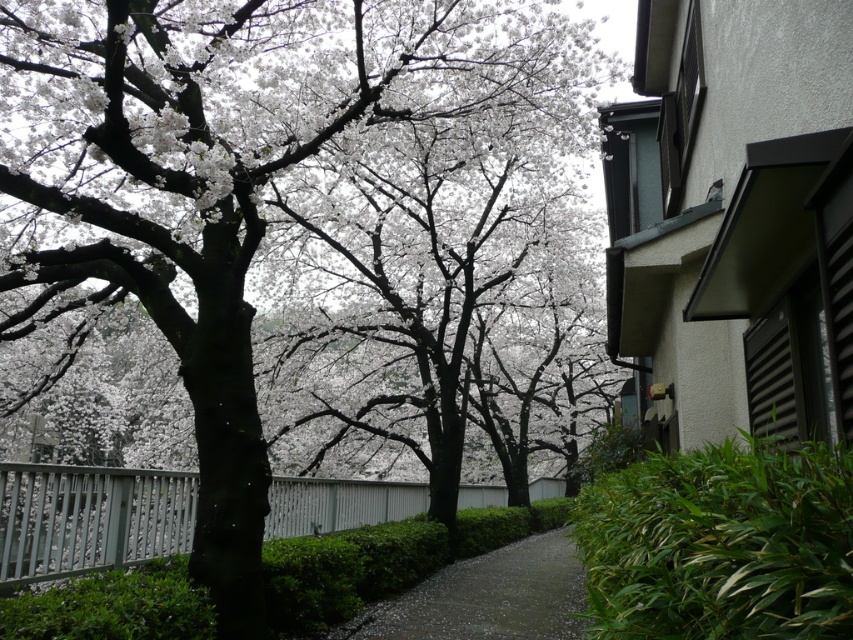
Can you confirm if white painted wood fence at lower left is wider than dark gray gravel path at center?

Correct, the width of white painted wood fence at lower left exceeds that of dark gray gravel path at center.

Between white painted wood fence at lower left and dark gray gravel path at center, which one has less height?

Standing shorter between the two is dark gray gravel path at center.

Locate an element on the screen. white painted wood fence at lower left is located at coordinates (90, 518).

This screenshot has width=853, height=640. I want to click on white painted wood fence at lower left, so click(90, 518).

Who is lower down, white blossoms at center or white painted wood fence at lower left?

Positioned lower is white painted wood fence at lower left.

Between white blossoms at center and white painted wood fence at lower left, which one has less height?

With less height is white painted wood fence at lower left.

Image resolution: width=853 pixels, height=640 pixels. In order to click on white blossoms at center in this screenshot , I will do `click(236, 180)`.

Which is above, white blossoms at center or dark gray gravel path at center?

Positioned higher is white blossoms at center.

Can you confirm if white blossoms at center is positioned above dark gray gravel path at center?

Indeed, white blossoms at center is positioned over dark gray gravel path at center.

Where is `white blossoms at center`? The height and width of the screenshot is (640, 853). white blossoms at center is located at coordinates (236, 180).